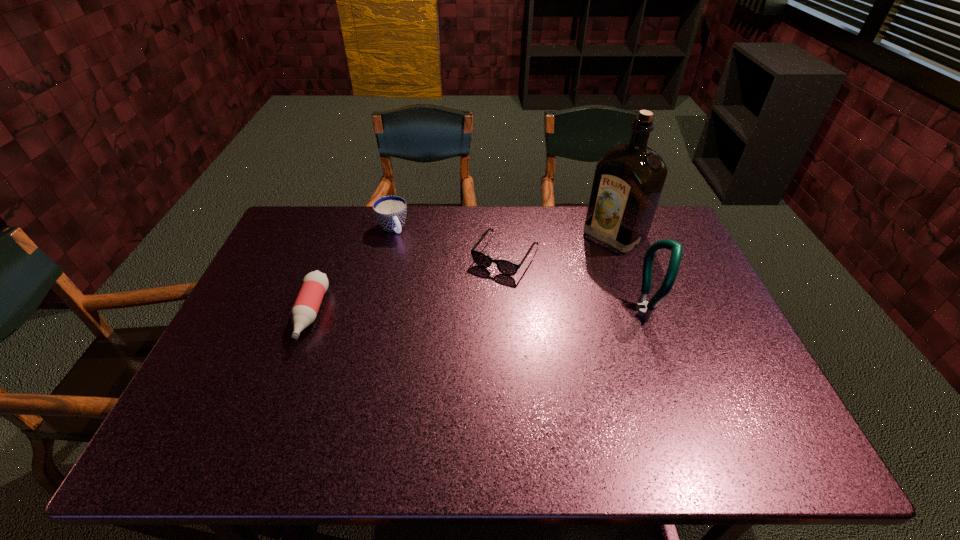
Identify the location of vacant spot on the desktop that is between the fourth tallest object and the fourth shortest object and is positioned on the side of the fourth object from right to left with the handle. (444, 313).

Find the location of a particular element. vacant spot on the desktop that is between the fourth tallest object and the second tallest object and is positioned on the label of the tallest object is located at coordinates (515, 313).

Locate an element on the screen. vacant space on the desktop that is between the bottle and the second tallest object and is positioned at the front lenses of the shortest object is located at coordinates (465, 313).